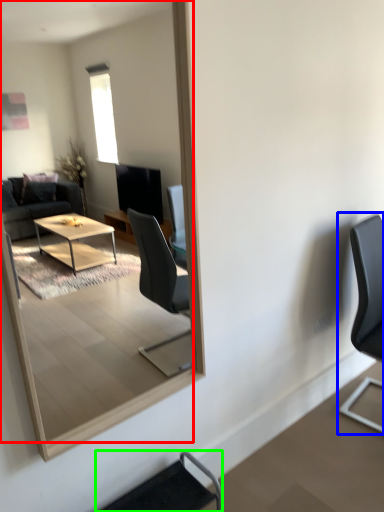
Question: Estimate the real-world distances between objects in this image. Which object is closer to mirror (highlighted by a red box), chair (highlighted by a blue box) or chair (highlighted by a green box)?

Choices:
 (A) chair
 (B) chair

Answer: (B)